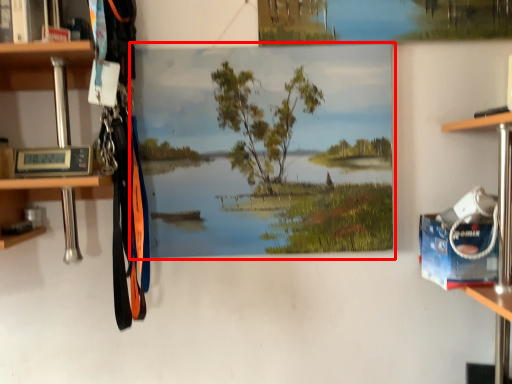
Question: Where is oil painting (annotated by the red box) located in relation to cabinet in the image?

Choices:
 (A) left
 (B) right

Answer: (B)